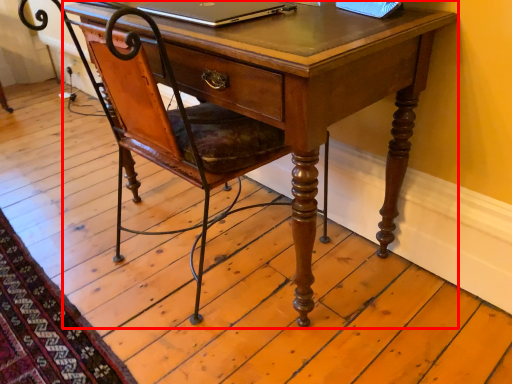
Question: From the image's perspective, considering the relative positions of desk (annotated by the red box) and laptop in the image provided, where is desk (annotated by the red box) located with respect to the staircase?

Choices:
 (A) below
 (B) above

Answer: (A)